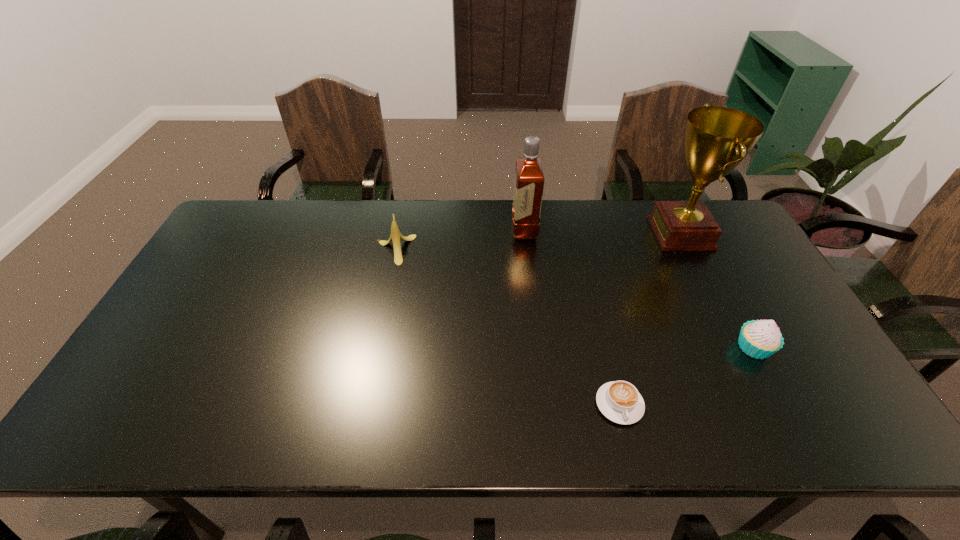
Locate an element on the screen. The width and height of the screenshot is (960, 540). vacant region located 0.150m on the front label of the fourth object from right to left is located at coordinates (468, 230).

Find the location of a particular element. free space located on the front label of the fourth object from right to left is located at coordinates (444, 230).

Identify the location of vacant space located 0.050m on the front label of the fourth object from right to left. (497, 230).

Locate an element on the screen. vacant space situated on the right of the banana is located at coordinates (499, 249).

Where is `blank space located on the back of the fourth farthest object`? The image size is (960, 540). blank space located on the back of the fourth farthest object is located at coordinates (708, 263).

Locate an element on the screen. award situated at the far edge is located at coordinates (716, 139).

You are a GUI agent. You are given a task and a screenshot of the screen. Output one action in this format:
    pyautogui.click(x=<x>, y=<y>)
    Task: Click on the liquor that is at the far edge
    The height and width of the screenshot is (540, 960).
    Given the screenshot: What is the action you would take?
    pyautogui.click(x=529, y=179)

The width and height of the screenshot is (960, 540). What are the coordinates of `banana situated at the far edge` in the screenshot? It's located at (396, 236).

This screenshot has height=540, width=960. In order to click on object at the near edge in this screenshot , I will do `click(619, 401)`.

Locate an element on the screen. This screenshot has height=540, width=960. award present at the right edge is located at coordinates pyautogui.click(x=716, y=139).